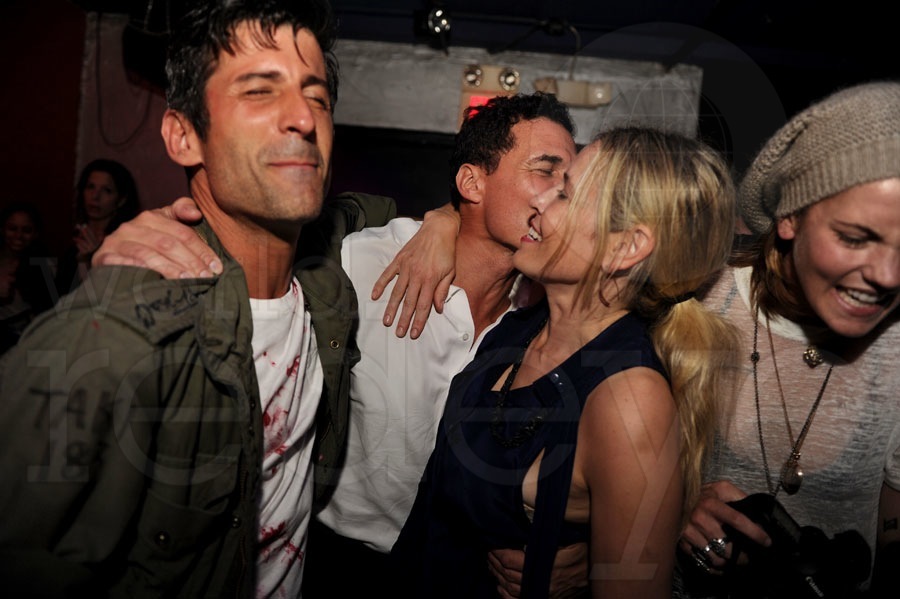
Find the location of a particular element. light is located at coordinates (441, 25), (471, 78), (508, 80).